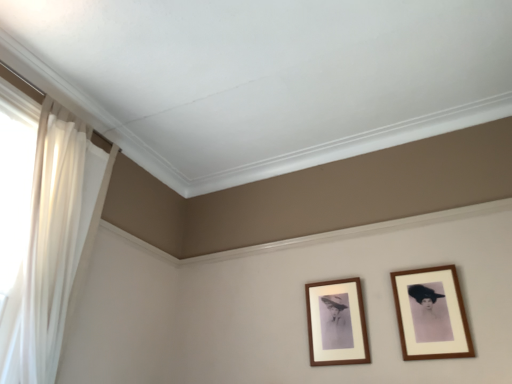
Question: Considering the positions of point (350, 360) and point (424, 309), is point (350, 360) closer or farther from the camera than point (424, 309)?

Choices:
 (A) closer
 (B) farther

Answer: (B)

Question: From a real-world perspective, is wooden frame at center, the second picture frame when ordered from right to left, above or below wooden frame at right, which is the first picture frame from right to left?

Choices:
 (A) below
 (B) above

Answer: (B)

Question: Considering the real-world distances, which object is closest to the wooden frame at center, arranged as the 1th picture frame when viewed from the left?

Choices:
 (A) white sheer curtain at left
 (B) wooden frame at right, which is counted as the second picture frame, starting from the left

Answer: (B)

Question: Estimate the real-world distances between objects in this image. Which object is farther from the white sheer curtain at left?

Choices:
 (A) wooden frame at right, which is counted as the second picture frame, starting from the left
 (B) wooden frame at center, the second picture frame when ordered from right to left

Answer: (A)